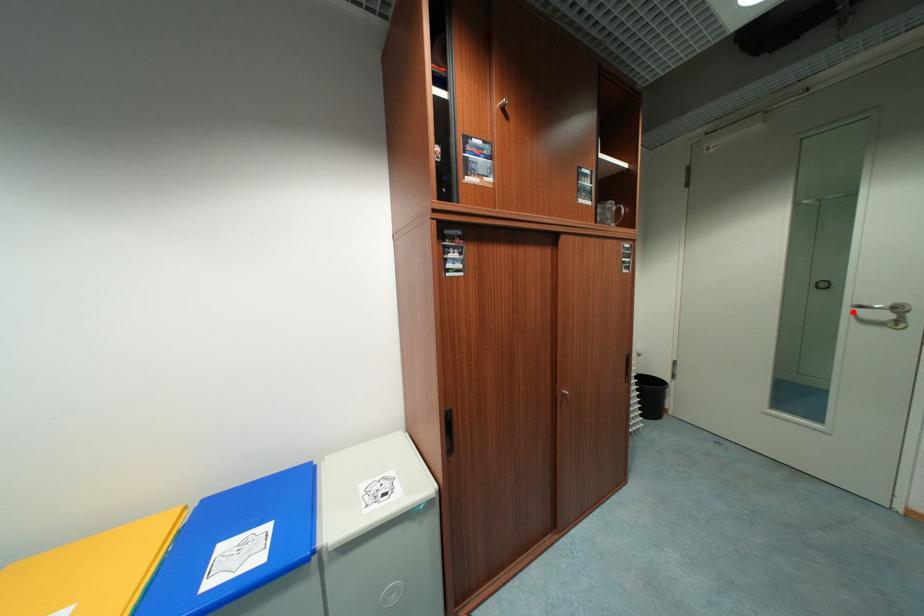
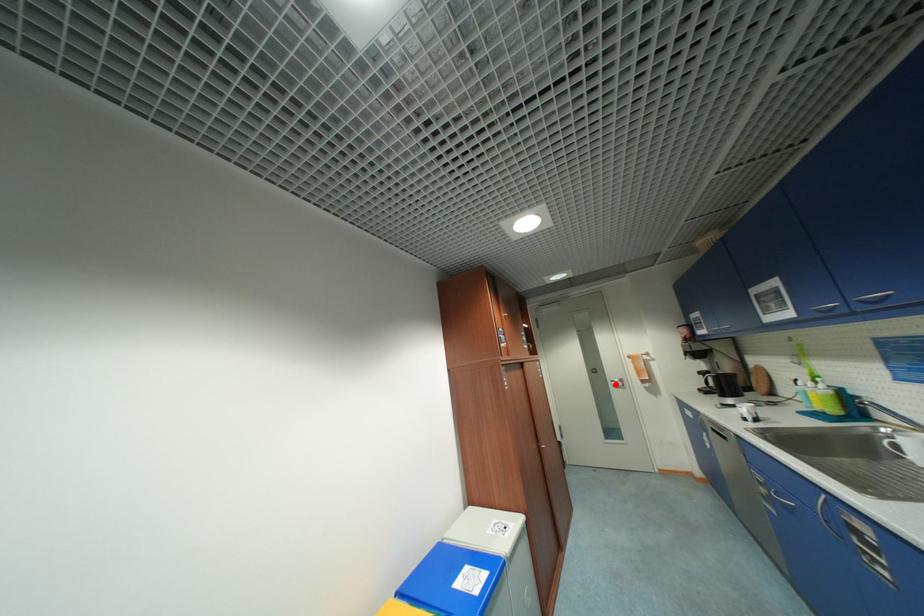
I am providing you with two images of the same scene from different viewpoints. A red point is marked on the first image and another point is marked on the second image. Is the red point in image1 aligned with the point shown in image2?

Yes